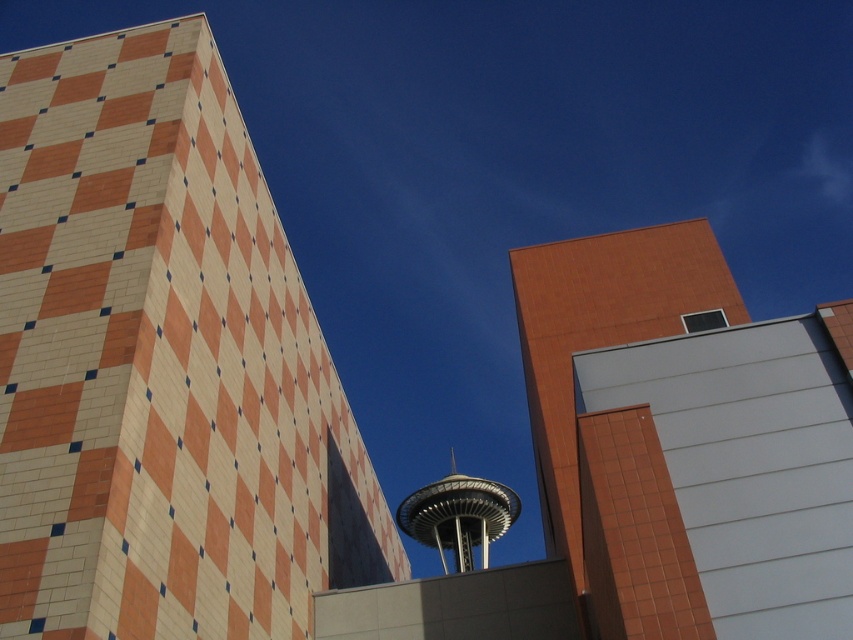
Question: Which object is farther from the camera taking this photo?

Choices:
 (A) orange-tiled tower at left
 (B) metallic silver tower at center

Answer: (B)

Question: Can you confirm if orange-tiled tower at left is positioned to the left of metallic silver tower at center?

Choices:
 (A) yes
 (B) no

Answer: (A)

Question: Is orange-tiled tower at left positioned at the back of metallic silver tower at center?

Choices:
 (A) yes
 (B) no

Answer: (B)

Question: Among these points, which one is farthest from the camera?

Choices:
 (A) (170, 83)
 (B) (438, 508)

Answer: (B)

Question: Does orange-tiled tower at left have a lesser width compared to metallic silver tower at center?

Choices:
 (A) yes
 (B) no

Answer: (B)